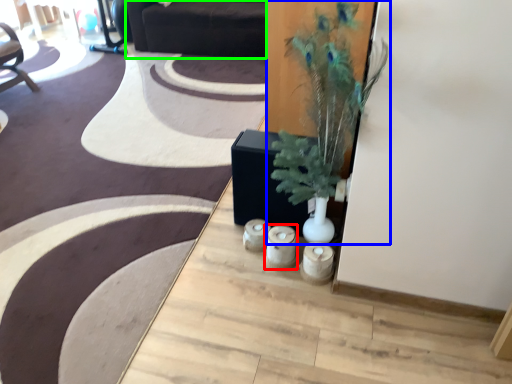
Question: Which object is the closest to the candle holder (highlighted by a red box)? Choose among these: houseplant (highlighted by a blue box) or couch (highlighted by a green box).

Choices:
 (A) houseplant
 (B) couch

Answer: (A)